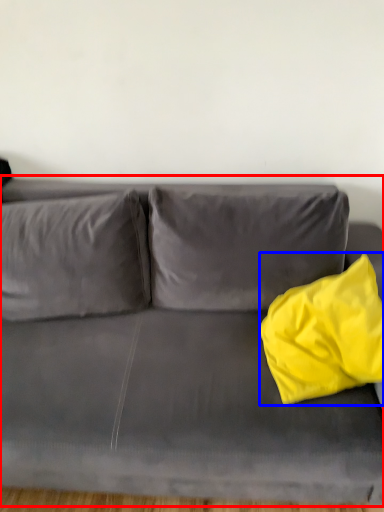
Question: Which object is further to the camera taking this photo, studio couch (highlighted by a red box) or throw pillow (highlighted by a blue box)?

Choices:
 (A) studio couch
 (B) throw pillow

Answer: (B)